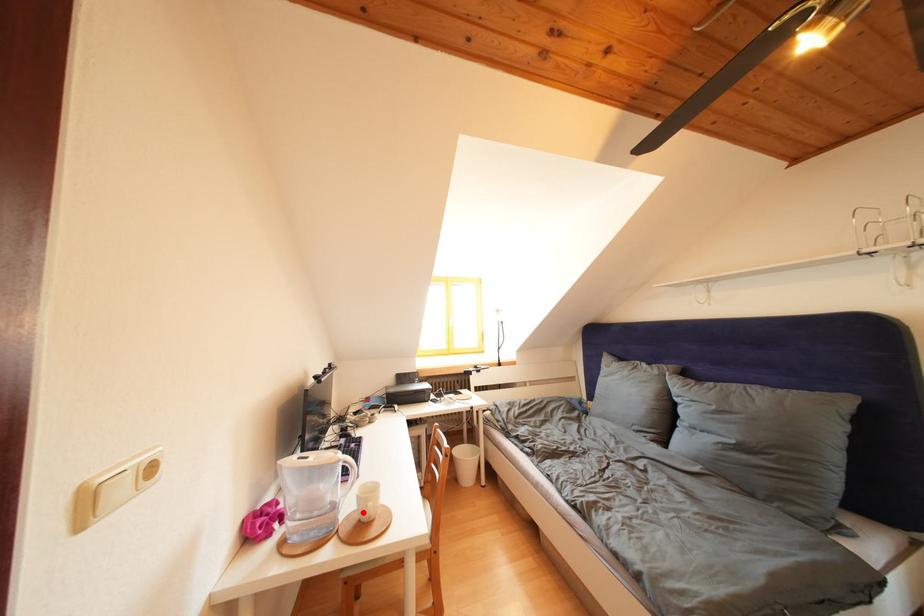
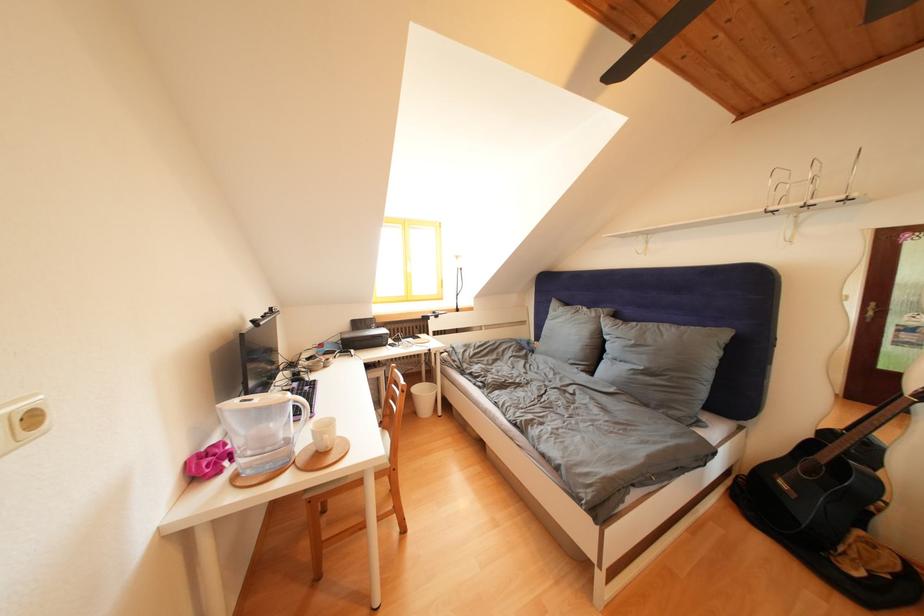
The point at the highlighted location is marked in the first image. Where is the corresponding point in the second image?

(320, 446)